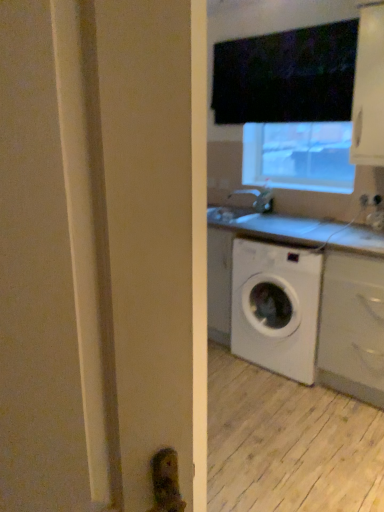
Question: From a real-world perspective, does white matte cabinet at lower right, the 2th cabinetry from the top, stand above matte silver faucet at center?

Choices:
 (A) no
 (B) yes

Answer: (A)

Question: Does white matte cabinet at lower right, the 2th cabinetry from the top, have a lesser height compared to matte silver faucet at center?

Choices:
 (A) yes
 (B) no

Answer: (B)

Question: Can you confirm if white matte cabinet at lower right, positioned as the first cabinetry in bottom-to-top order, is bigger than matte silver faucet at center?

Choices:
 (A) no
 (B) yes

Answer: (B)

Question: From the image's perspective, is white matte cabinet at lower right, positioned as the first cabinetry in bottom-to-top order, under matte silver faucet at center?

Choices:
 (A) no
 (B) yes

Answer: (B)

Question: Does white matte cabinet at lower right, the 2th cabinetry from the top, have a greater height compared to matte silver faucet at center?

Choices:
 (A) no
 (B) yes

Answer: (B)

Question: Is white matte cabinet at lower right, positioned as the first cabinetry in bottom-to-top order, in contact with matte silver faucet at center?

Choices:
 (A) yes
 (B) no

Answer: (B)

Question: Is white plastic electric outlet at upper right shorter than white glossy cabinet at upper right, the second cabinetry positioned from the bottom?

Choices:
 (A) yes
 (B) no

Answer: (A)

Question: Considering the relative sizes of white plastic electric outlet at upper right and white glossy cabinet at upper right, the first cabinetry positioned from the top, in the image provided, is white plastic electric outlet at upper right smaller than white glossy cabinet at upper right, the first cabinetry positioned from the top,?

Choices:
 (A) no
 (B) yes

Answer: (B)

Question: Is the position of white plastic electric outlet at upper right less distant than that of white glossy cabinet at upper right, the first cabinetry positioned from the top?

Choices:
 (A) no
 (B) yes

Answer: (A)

Question: From a real-world perspective, is white plastic electric outlet at upper right positioned over white glossy cabinet at upper right, the second cabinetry positioned from the bottom, based on gravity?

Choices:
 (A) no
 (B) yes

Answer: (A)

Question: Does white plastic electric outlet at upper right have a greater width compared to white glossy cabinet at upper right, the first cabinetry positioned from the top?

Choices:
 (A) yes
 (B) no

Answer: (B)

Question: Is white plastic electric outlet at upper right oriented away from white glossy cabinet at upper right, the first cabinetry positioned from the top?

Choices:
 (A) no
 (B) yes

Answer: (A)

Question: Can you confirm if white matte cabinet at lower right, positioned as the first cabinetry in bottom-to-top order, is wider than white glossy cabinet at upper right, the second cabinetry positioned from the bottom?

Choices:
 (A) no
 (B) yes

Answer: (B)